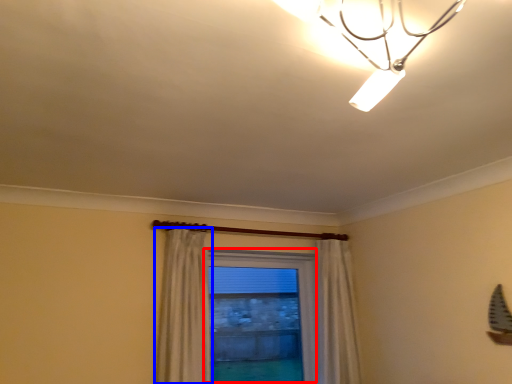
Question: Which of the following is the farthest to the observer, window (highlighted by a red box) or curtain (highlighted by a blue box)?

Choices:
 (A) window
 (B) curtain

Answer: (A)